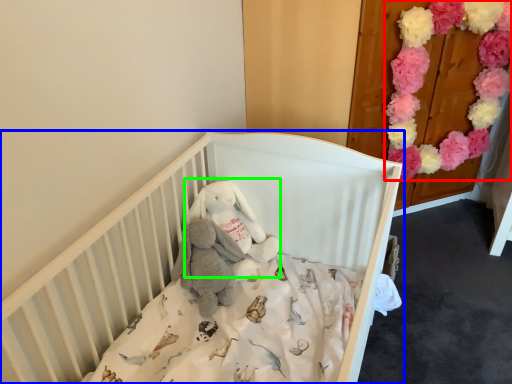
Question: Which object is positioned closest to flower (highlighted by a red box)? Select from infant bed (highlighted by a blue box) and toy (highlighted by a green box).

Choices:
 (A) infant bed
 (B) toy

Answer: (A)